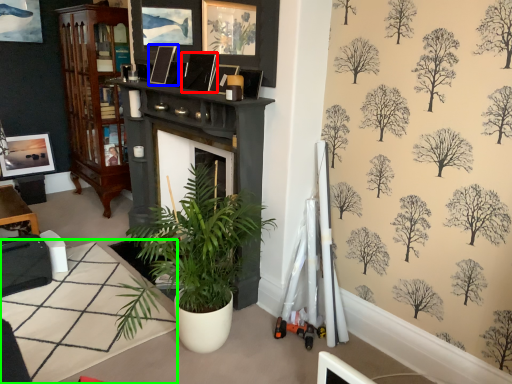
Question: Which object is positioned farthest from picture frame (highlighted by a red box)? Select from picture frame (highlighted by a blue box) and table (highlighted by a green box).

Choices:
 (A) picture frame
 (B) table

Answer: (B)